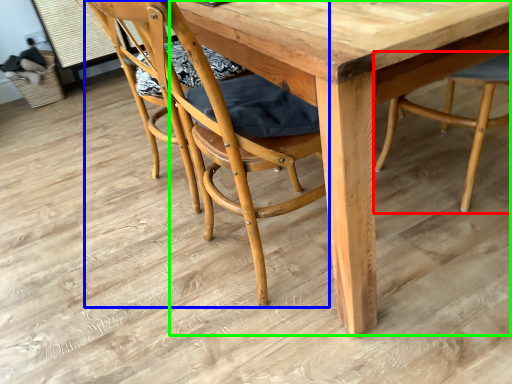
Question: Which is farther away from chair (highlighted by a red box)? chair (highlighted by a blue box) or round table (highlighted by a green box)?

Choices:
 (A) chair
 (B) round table

Answer: (A)